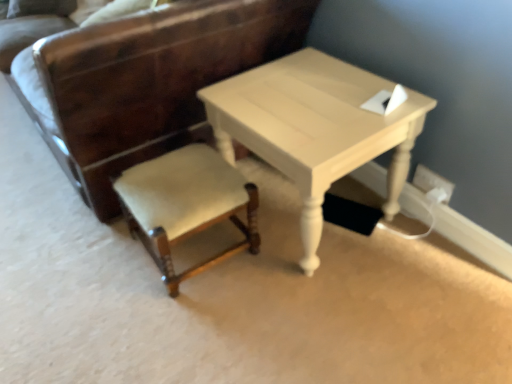
Question: In the image, is velvet beige chair at lower left, the 2th chair positioned from the bottom, on the left side or the right side of white plastic electric outlet at lower right?

Choices:
 (A) right
 (B) left

Answer: (B)

Question: Which is correct: velvet beige chair at lower left, the 1th chair when ordered from top to bottom, is inside white plastic electric outlet at lower right, or outside of it?

Choices:
 (A) outside
 (B) inside

Answer: (A)

Question: Estimate the real-world distances between objects in this image. Which object is closer to the light beige wood table at center?

Choices:
 (A) velvet beige stool at center, the 2th chair in the top-to-bottom sequence
 (B) white plastic electric outlet at lower right
 (C) velvet beige chair at lower left, the 2th chair positioned from the bottom

Answer: (A)

Question: Estimate the real-world distances between objects in this image. Which object is closer to the velvet beige chair at lower left, the 2th chair positioned from the bottom?

Choices:
 (A) velvet beige stool at center, which appears as the 1th chair when ordered from the bottom
 (B) white plastic electric outlet at lower right
 (C) light beige wood table at center

Answer: (A)